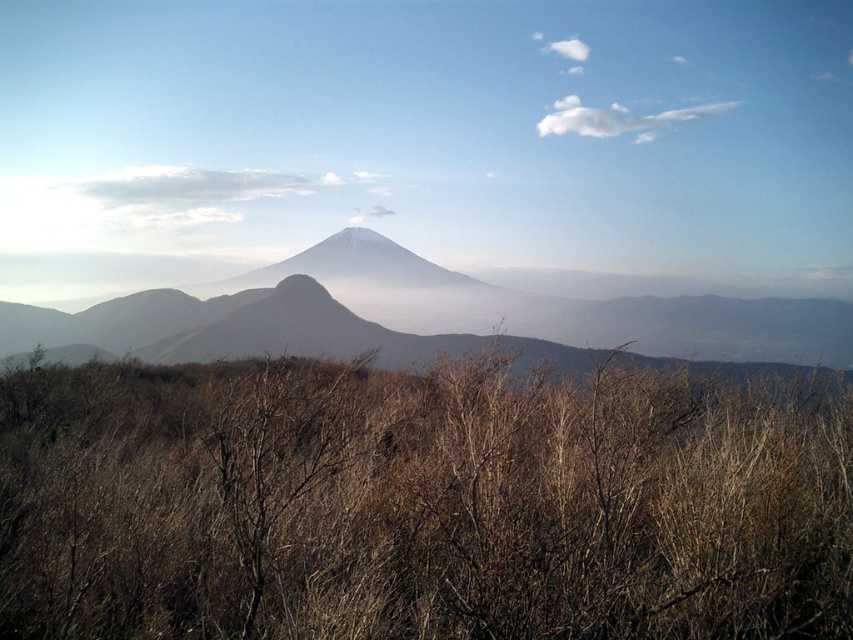
Question: Estimate the real-world distances between objects in this image. Which object is farther from the brown dry bush at center?

Choices:
 (A) white fluffy cloud at upper center
 (B) white snow-capped mountain at center

Answer: (A)

Question: Is brown dry bush at center wider than white snow-capped mountain at center?

Choices:
 (A) no
 (B) yes

Answer: (A)

Question: Which object is the farthest from the white fluffy cloud at upper center?

Choices:
 (A) brown dry bush at center
 (B) white snow-capped mountain at center

Answer: (A)

Question: Is white snow-capped mountain at center bigger than white fluffy cloud at upper center?

Choices:
 (A) no
 (B) yes

Answer: (B)

Question: Can you confirm if brown dry bush at center is positioned to the left of white snow-capped mountain at center?

Choices:
 (A) no
 (B) yes

Answer: (B)

Question: Among these objects, which one is nearest to the camera?

Choices:
 (A) white snow-capped mountain at center
 (B) white fluffy cloud at upper center

Answer: (A)